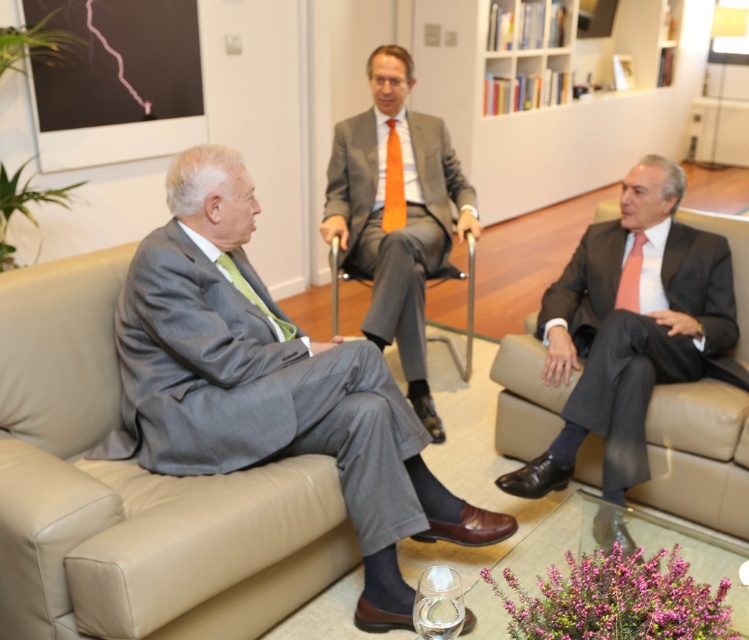
You are a photographer standing in the room and want to take a photo that includes both point (333, 285) and point (636, 250). Since you want the closer point to be in focus, which point should you focus on?

Point (333, 285) is further to the viewer than point (636, 250), so you should focus on point (636, 250) because it is closer to you.

You are a server at a formal event and need to deliver a tray of drinks to the orange silk tie at center without disturbing the metallic gray chair at center. What is the minimum distance you should maintain between the tray and the chair to ensure it doesn not move?

The metallic gray chair at center is 54.51 centimeters from orange silk tie at center. To avoid moving the chair, the tray should be placed at least 54.51 centimeters away from the metallic gray chair at center.